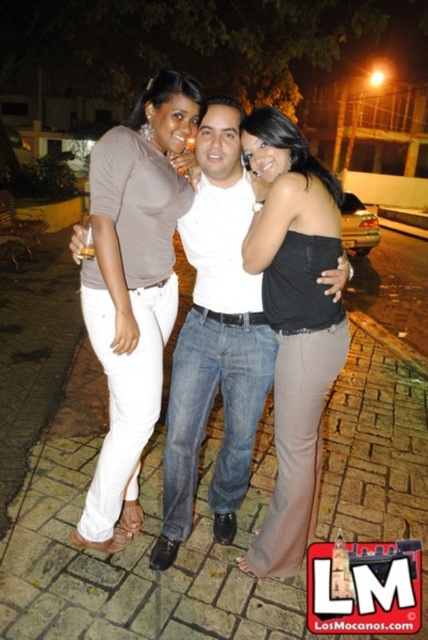
Is matte brown shirt at upper left smaller than black satin strapless top at center?

No.

Does matte brown shirt at upper left appear on the left side of black satin strapless top at center?

Indeed, matte brown shirt at upper left is positioned on the left side of black satin strapless top at center.

At what (x,y) coordinates should I click in order to perform the action: click on matte brown shirt at upper left. Please return your answer as a coordinate pair (x, y). Looking at the image, I should click on (133, 285).

In order to click on matte brown shirt at upper left in this screenshot , I will do `click(133, 285)`.